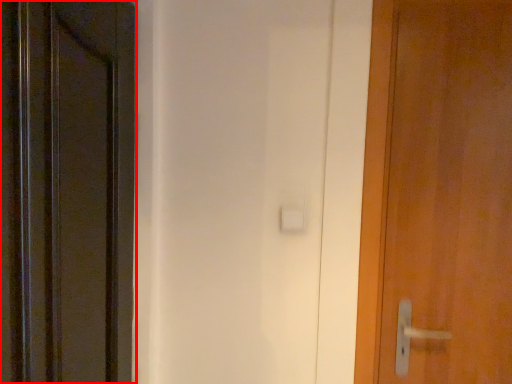
Question: In this image, where is door (annotated by the red box) located relative to door?

Choices:
 (A) right
 (B) left

Answer: (B)